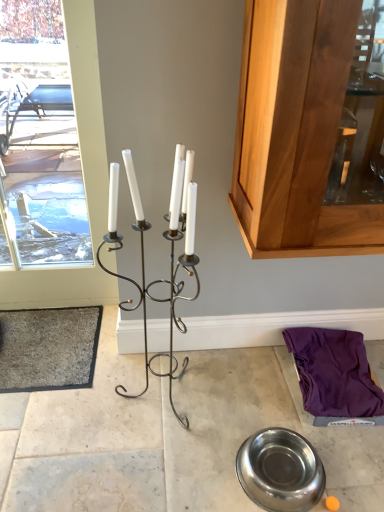
Locate an element on the screen. This screenshot has width=384, height=512. vacant space in between polished stainless steel bowl at lower center and gray carpet at lower left is located at coordinates (144, 413).